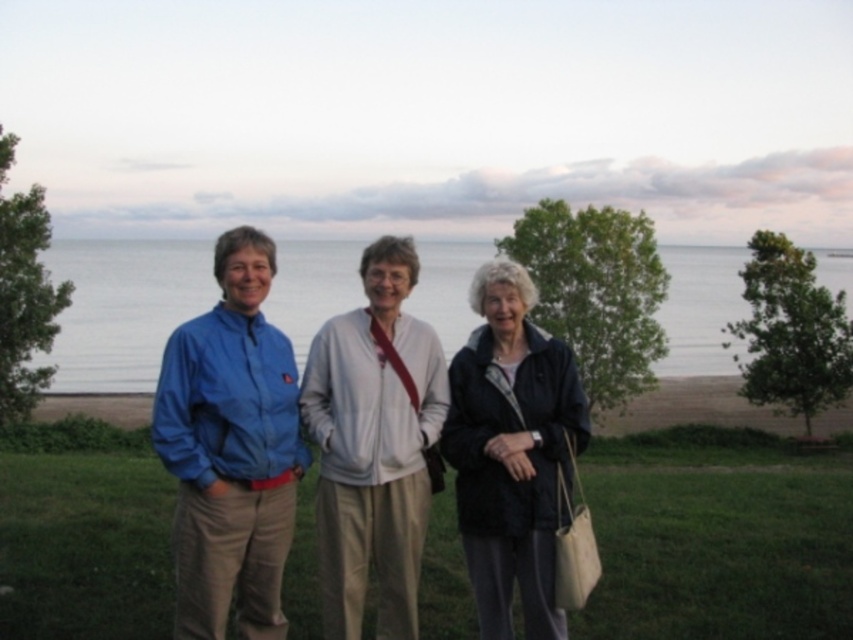
You are a GUI agent. You are given a task and a screenshot of the screen. Output one action in this format:
    pyautogui.click(x=<x>, y=<y>)
    Task: Click on the blue water at center
    
    Given the screenshot: What is the action you would take?
    pyautogui.click(x=123, y=308)

Based on the photo, who is higher up, blue water at center or white matte jacket at center?

blue water at center

Which is behind, point (685, 317) or point (325, 554)?

Point (685, 317)

Find the location of a particular element. blue water at center is located at coordinates (123, 308).

What are the coordinates of `blue water at center` in the screenshot? It's located at (123, 308).

Is point (126, 296) behind point (440, 438)?

Yes, it is behind point (440, 438).

In order to click on blue water at center in this screenshot , I will do `click(123, 308)`.

Can you confirm if green grass at center is thinner than white matte jacket at center?

No.

Is green grass at center wider than white matte jacket at center?

Correct, the width of green grass at center exceeds that of white matte jacket at center.

Is point (6, 483) positioned after point (373, 340)?

Yes, it is behind point (373, 340).

The image size is (853, 640). What are the coordinates of `green grass at center` in the screenshot? It's located at (720, 552).